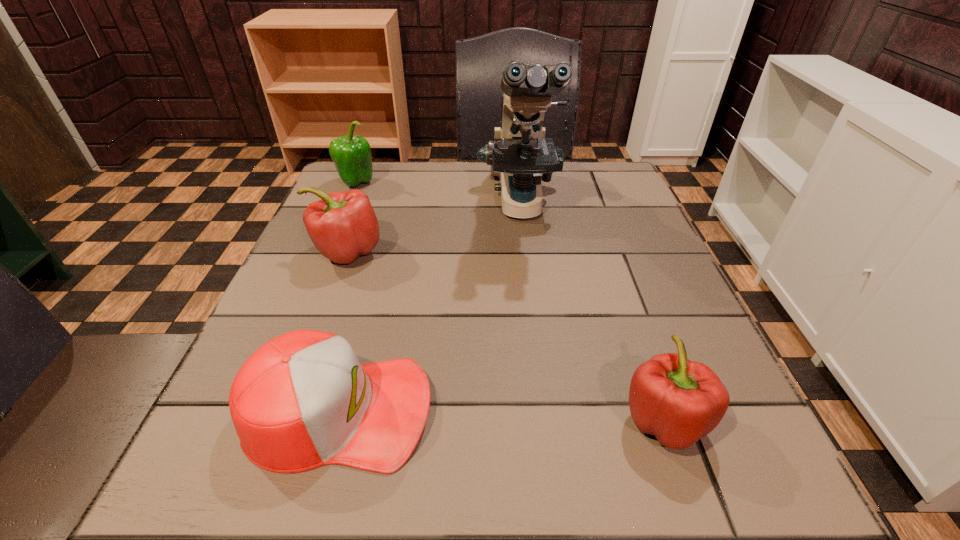
At what (x,y) coordinates should I click in order to perform the action: click on the tallest object. Please return your answer as a coordinate pair (x, y). Looking at the image, I should click on (519, 153).

At what (x,y) coordinates should I click in order to perform the action: click on the farthest bell pepper. Please return your answer as a coordinate pair (x, y). Looking at the image, I should click on (352, 157).

I want to click on the second shortest bell pepper, so click(x=342, y=225).

Find the location of a particular element. The height and width of the screenshot is (540, 960). the third shortest object is located at coordinates (342, 225).

You are a GUI agent. You are given a task and a screenshot of the screen. Output one action in this format:
    pyautogui.click(x=<x>, y=<y>)
    Task: Click on the baseball cap
    Image resolution: width=960 pixels, height=540 pixels.
    Given the screenshot: What is the action you would take?
    pyautogui.click(x=302, y=400)

This screenshot has width=960, height=540. I want to click on the rightmost bell pepper, so click(679, 401).

Image resolution: width=960 pixels, height=540 pixels. What are the coordinates of `the nearest bell pepper` in the screenshot? It's located at (679, 401).

You are a GUI agent. You are given a task and a screenshot of the screen. Output one action in this format:
    pyautogui.click(x=<x>, y=<y>)
    Task: Click on the free space located through the eyepieces of the tallest object
    Image resolution: width=960 pixels, height=540 pixels.
    Given the screenshot: What is the action you would take?
    pyautogui.click(x=529, y=269)

Locate an element on the screen. blank space located on the front of the farthest bell pepper is located at coordinates (331, 244).

Identify the location of vacant space positioned 0.150m on the front of the second nearest bell pepper. (317, 333).